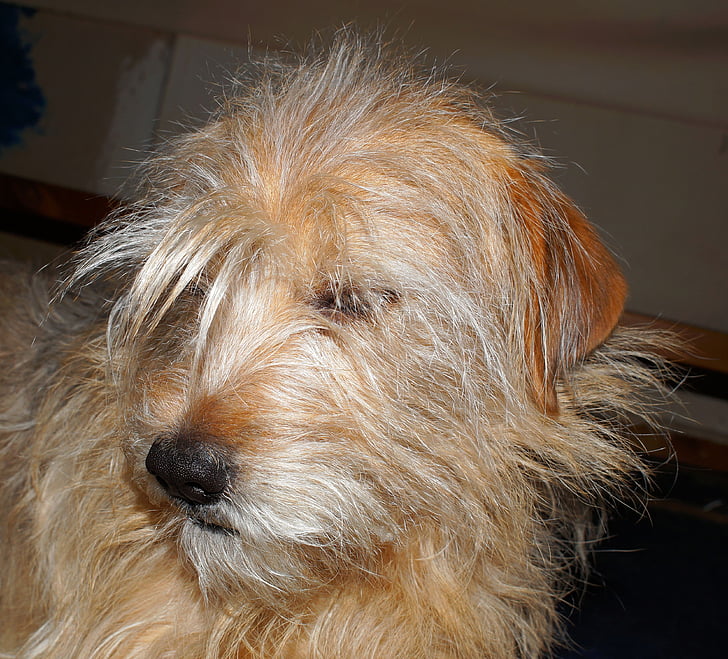
Where is `right side of green plant`? right side of green plant is located at coordinates (20, 97).